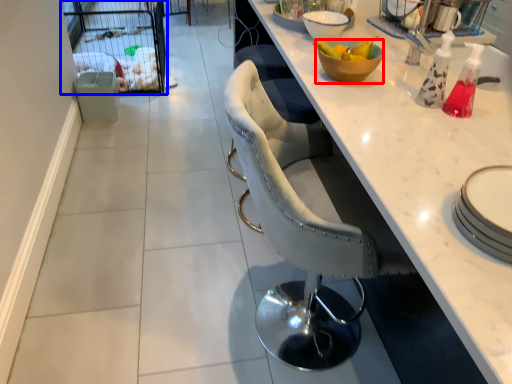
Question: Among these objects, which one is farthest to the camera, bowl (highlighted by a red box) or screen door (highlighted by a blue box)?

Choices:
 (A) bowl
 (B) screen door

Answer: (B)